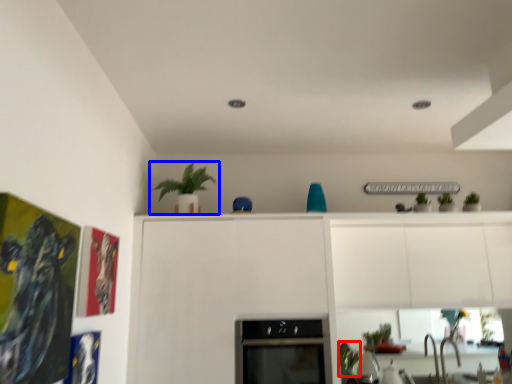
Question: Which object is further to the camera taking this photo, plant (highlighted by a red box) or houseplant (highlighted by a blue box)?

Choices:
 (A) plant
 (B) houseplant

Answer: (A)